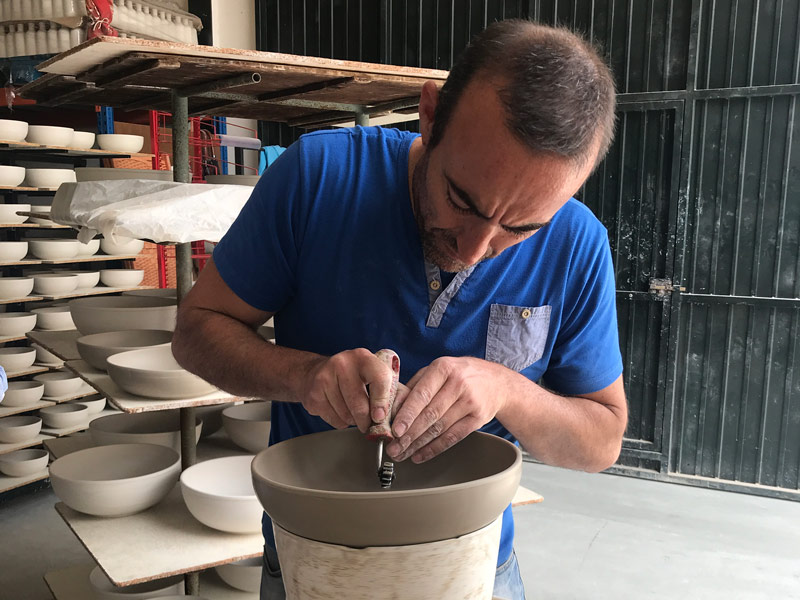
Image resolution: width=800 pixels, height=600 pixels. Identify the location of bowl. (214, 478), (168, 365), (122, 350), (128, 310), (110, 495).